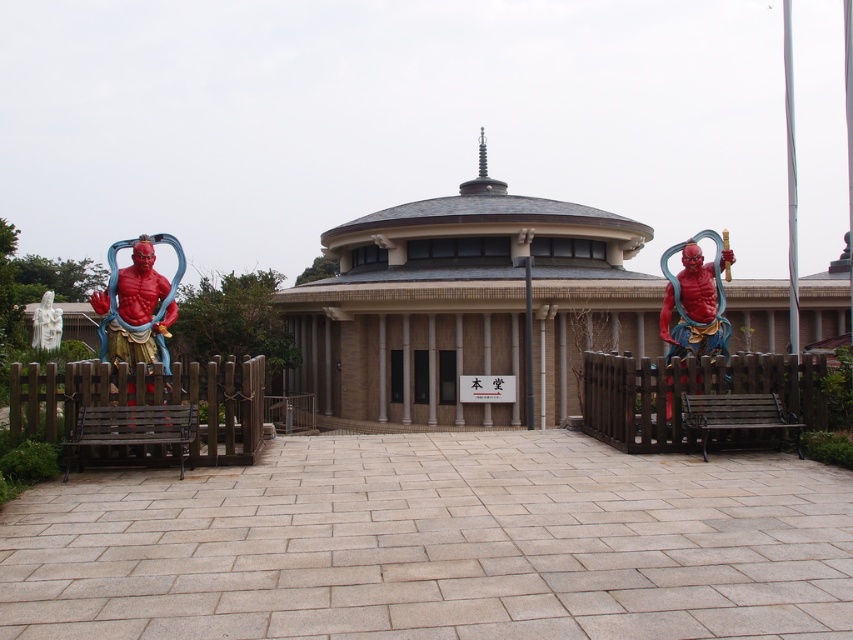
You are standing in front of the traditional building with a rounded roof. There are two points marked in the image, point (703, 307) and point (526, 324). Which point is closer to you?

Point (703, 307) is in front of point (526, 324), so it is closer to you.

You are a tourist visiting the courtyard and want to take a photo of both the shiny red statue at left and the white marble statue at lower left. Which statue should you position closer to the camera to include both in the frame?

The shiny red statue at left is located below the white marble statue at lower left. To include both in the frame, position the camera closer to the shiny red statue at left so that the white marble statue at lower left appears in the background.